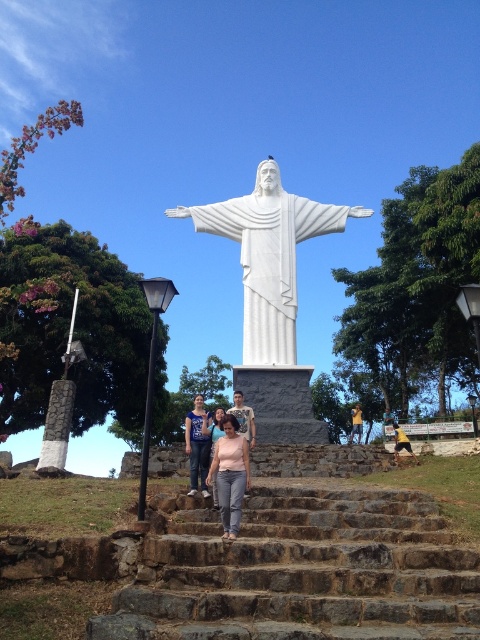
You are standing at the base of the statue of Jesus Christ and want to take a photo of the point at coordinates point (193, 220). If your camera can focus on objects up to 250 feet away, will it be able to capture that point clearly?

The point (193, 220) is 262.10 feet away from the camera, which exceeds the camera maximum focusing distance of 250 feet. Therefore, the camera will not be able to capture the point clearly.

You are an artist planning to paint a scene of the statue and the people below. You want to ensure the pink matte shirt at center and the blue denim shirt at center are proportionally accurate. Which shirt should you paint as narrower?

The pink matte shirt at center should be painted as narrower because its width is less than the blue denim shirt at center.

You are standing at the base of the statue and want to find the pink matte shirt at center. Where should you look in relation to the statue?

The pink matte shirt at center is located at the center of the image, specifically at coordinates point (229, 474), so you should look towards the middle area near the statue.